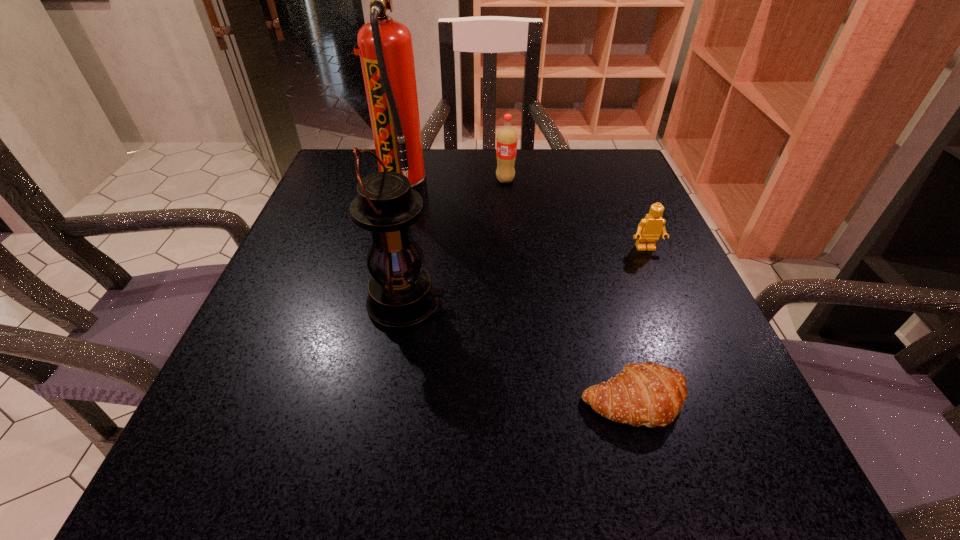
The width and height of the screenshot is (960, 540). What are the coordinates of `vacant space at the far edge of the desktop` in the screenshot? It's located at (487, 184).

The height and width of the screenshot is (540, 960). Find the location of `free space at the near edge`. free space at the near edge is located at coordinates (387, 465).

In the image, there is a desktop. Identify the location of free space at the left edge. (324, 244).

The width and height of the screenshot is (960, 540). I want to click on vacant region at the right edge of the desktop, so click(x=713, y=411).

In the image, there is a desktop. What are the coordinates of `vacant space at the far left corner` in the screenshot? It's located at (343, 158).

At what (x,y) coordinates should I click in order to perform the action: click on vacant space at the far right corner. Please return your answer as a coordinate pair (x, y). Image resolution: width=960 pixels, height=540 pixels. Looking at the image, I should click on (x=580, y=154).

Where is `vacant space at the near right corner of the desktop`? vacant space at the near right corner of the desktop is located at coordinates (666, 478).

This screenshot has height=540, width=960. Identify the location of free spot between the soda and the fourth shortest object. (456, 242).

Image resolution: width=960 pixels, height=540 pixels. I want to click on free space between the Lego and the nearest object, so click(x=640, y=325).

Where is `free space between the crescent roll and the second shortest object`? This screenshot has height=540, width=960. free space between the crescent roll and the second shortest object is located at coordinates (640, 325).